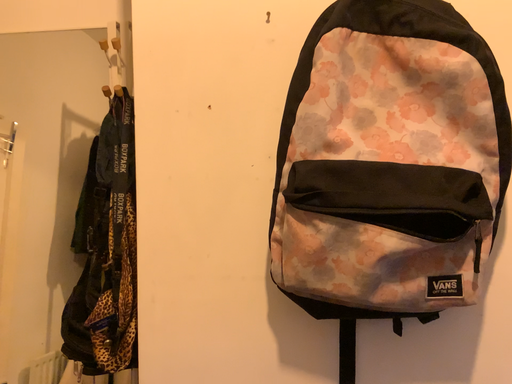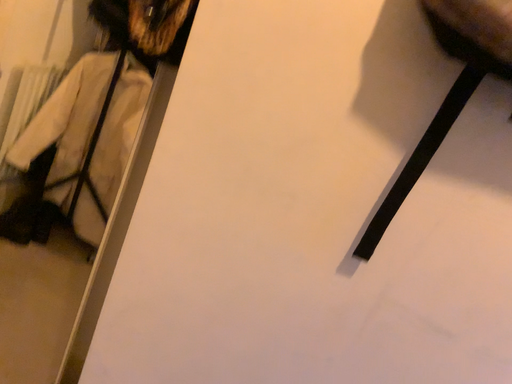
Question: How did the camera likely rotate when shooting the video?

Choices:
 (A) rotated upward
 (B) rotated downward

Answer: (B)